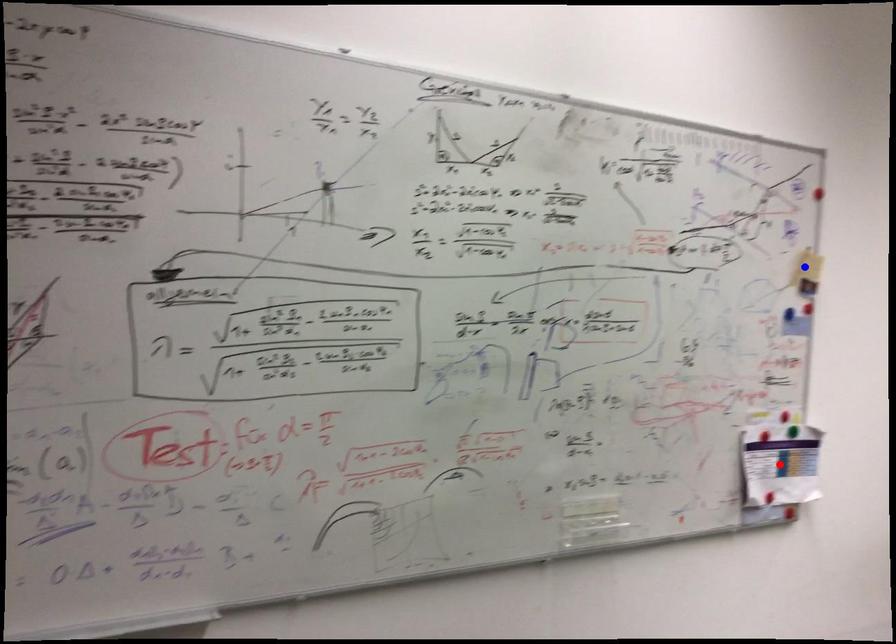
Question: Two points are marked on the image. Which point is closer to the camera?

Choices:
 (A) Blue point is closer.
 (B) Red point is closer.

Answer: (B)